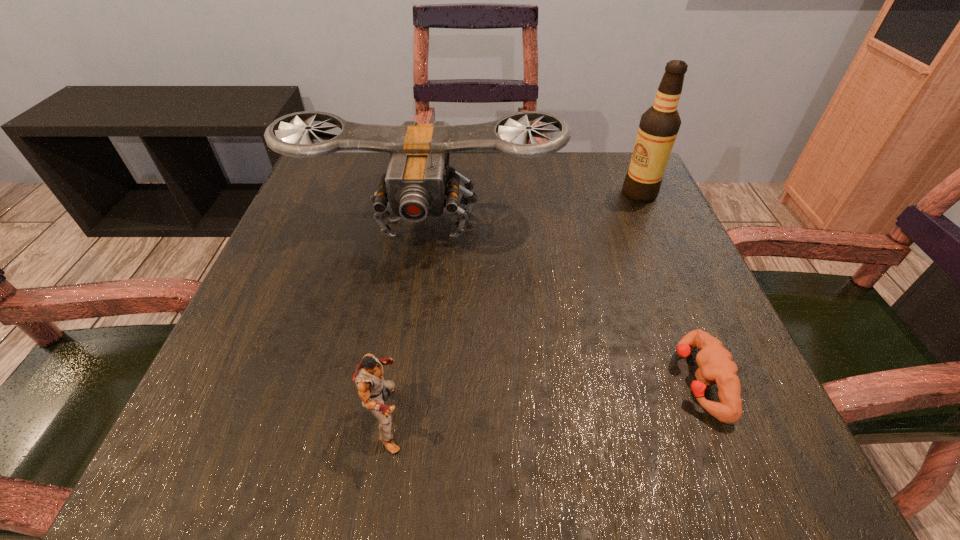
At what (x,y) coordinates should I click in order to perform the action: click on object that ranks as the second closest to the third tallest object. Please return your answer as a coordinate pair (x, y). This screenshot has height=540, width=960. Looking at the image, I should click on 716,366.

Locate an element on the screen. Image resolution: width=960 pixels, height=540 pixels. free region that satisfies the following two spatial constraints: 1. on the label of the alcohol; 2. on the front-facing side of the drone is located at coordinates (652, 221).

Where is `blank space that satisfies the following two spatial constraints: 1. on the label of the tallest object; 2. on the front-facing side of the drone`? This screenshot has height=540, width=960. blank space that satisfies the following two spatial constraints: 1. on the label of the tallest object; 2. on the front-facing side of the drone is located at coordinates tap(652, 221).

This screenshot has height=540, width=960. I want to click on vacant space that satisfies the following two spatial constraints: 1. on the front-facing side of the drone; 2. on the front-facing side of the left puncher, so click(399, 418).

Locate an element on the screen. The height and width of the screenshot is (540, 960). vacant area that satisfies the following two spatial constraints: 1. on the label of the alcohol; 2. on the front-facing side of the second tallest object is located at coordinates (652, 221).

Where is `free space that satisfies the following two spatial constraints: 1. on the front-facing side of the drone; 2. on the front-facing side of the third tallest object`? This screenshot has height=540, width=960. free space that satisfies the following two spatial constraints: 1. on the front-facing side of the drone; 2. on the front-facing side of the third tallest object is located at coordinates [x=399, y=418].